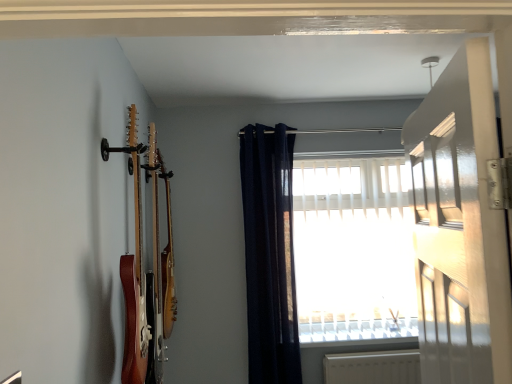
Question: Considering the relative sizes of wooden acoustic guitar at left, which ranks as the second guitar in front-to-back order, and white glossy door at upper right in the image provided, is wooden acoustic guitar at left, which ranks as the second guitar in front-to-back order, smaller than white glossy door at upper right?

Choices:
 (A) no
 (B) yes

Answer: (B)

Question: From a real-world perspective, is wooden acoustic guitar at left, which is the 1th guitar from back to front, on white glossy door at upper right?

Choices:
 (A) no
 (B) yes

Answer: (B)

Question: Is wooden acoustic guitar at left, which is the 1th guitar from back to front, wider than white glossy door at upper right?

Choices:
 (A) no
 (B) yes

Answer: (B)

Question: Is white glossy door at upper right a part of wooden acoustic guitar at left, which is the 1th guitar from back to front?

Choices:
 (A) no
 (B) yes

Answer: (A)

Question: From the image's perspective, is wooden acoustic guitar at left, which is the 1th guitar from back to front, over white glossy door at upper right?

Choices:
 (A) no
 (B) yes

Answer: (A)

Question: Relative to navy blue fabric curtain at upper center, is wooden acoustic guitar at left, the 1th guitar positioned from the front, in front or behind?

Choices:
 (A) front
 (B) behind

Answer: (A)

Question: From the image's perspective, is wooden acoustic guitar at left, placed as the second guitar when sorted from back to front, positioned above or below navy blue fabric curtain at upper center?

Choices:
 (A) above
 (B) below

Answer: (A)

Question: Does point (144, 349) appear closer or farther from the camera than point (259, 231)?

Choices:
 (A) closer
 (B) farther

Answer: (A)

Question: From a real-world perspective, is wooden acoustic guitar at left, placed as the second guitar when sorted from back to front, above or below navy blue fabric curtain at upper center?

Choices:
 (A) below
 (B) above

Answer: (B)

Question: From a real-world perspective, is wooden acoustic guitar at left, the 1th guitar positioned from the front, positioned above or below white plastic window sill at lower center?

Choices:
 (A) above
 (B) below

Answer: (A)

Question: From the image's perspective, is wooden acoustic guitar at left, placed as the second guitar when sorted from back to front, located above or below white plastic window sill at lower center?

Choices:
 (A) below
 (B) above

Answer: (B)

Question: Considering the positions of point (138, 187) and point (357, 342), is point (138, 187) closer or farther from the camera than point (357, 342)?

Choices:
 (A) closer
 (B) farther

Answer: (A)

Question: Would you say wooden acoustic guitar at left, the 1th guitar positioned from the front, is to the left or to the right of white plastic window sill at lower center in the picture?

Choices:
 (A) left
 (B) right

Answer: (A)

Question: From the image's perspective, is wooden acoustic guitar at left, placed as the second guitar when sorted from back to front, above or below wooden acoustic guitar at left, which is the 1th guitar from back to front?

Choices:
 (A) below
 (B) above

Answer: (B)

Question: Considering the positions of wooden acoustic guitar at left, placed as the second guitar when sorted from back to front, and wooden acoustic guitar at left, which ranks as the second guitar in front-to-back order, in the image, is wooden acoustic guitar at left, placed as the second guitar when sorted from back to front, bigger or smaller than wooden acoustic guitar at left, which ranks as the second guitar in front-to-back order,?

Choices:
 (A) big
 (B) small

Answer: (A)